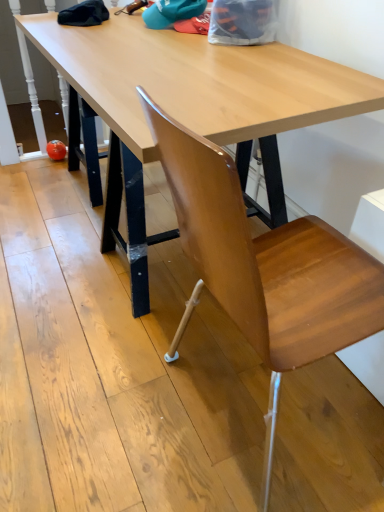
Where is `vacant space underneath wooden chair at center (from a real-world perspective)`? The width and height of the screenshot is (384, 512). vacant space underneath wooden chair at center (from a real-world perspective) is located at coordinates (249, 408).